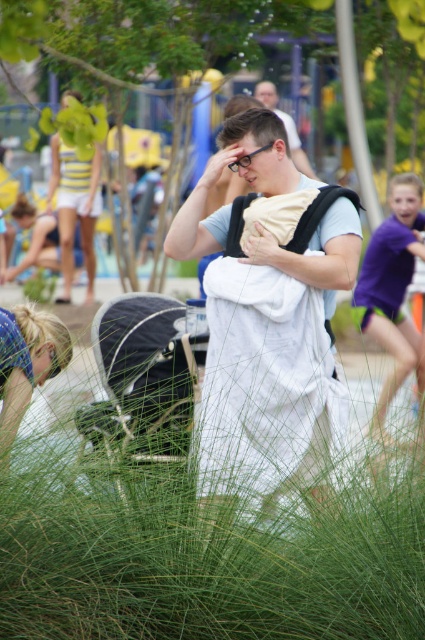
You are standing in the park and see the green soft grass at center and the yellow striped tank top at upper left. Which object is taller?

The yellow striped tank top at upper left is taller than the green soft grass at center.

Consider the image. You are standing in the park and see two points in the scene. Which point is closer to you, point (238, 380) or point (289, 129)?

Point (238, 380) is closer to the viewer than point (289, 129).

Based on the photo, you are a parent trying to find a spot to place your toddler who is about 4 feet tall. You see the green soft grass at center and the blonde hair at lower left. Which location would allow the toddler to sit without being completely hidden from view?

The blonde hair at lower left is shorter than the green soft grass at center, so placing the toddler there would ensure they are visible since the grass is not as tall.